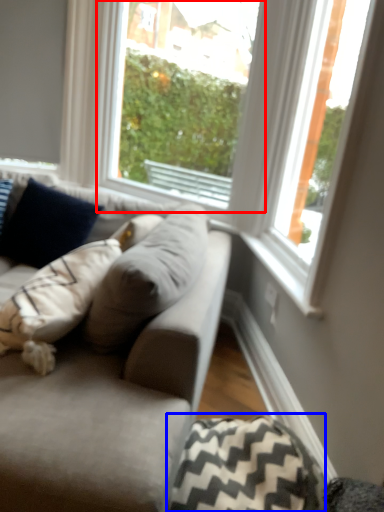
Question: Which of the following is the closest to the observer, window (highlighted by a red box) or pillow (highlighted by a blue box)?

Choices:
 (A) window
 (B) pillow

Answer: (B)